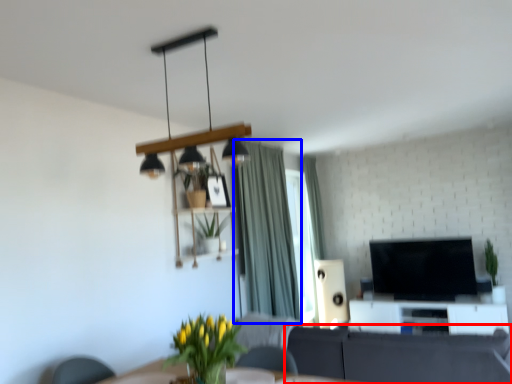
Question: Which object appears closest to the camera in this image, studio couch (highlighted by a red box) or curtain (highlighted by a blue box)?

Choices:
 (A) studio couch
 (B) curtain

Answer: (A)